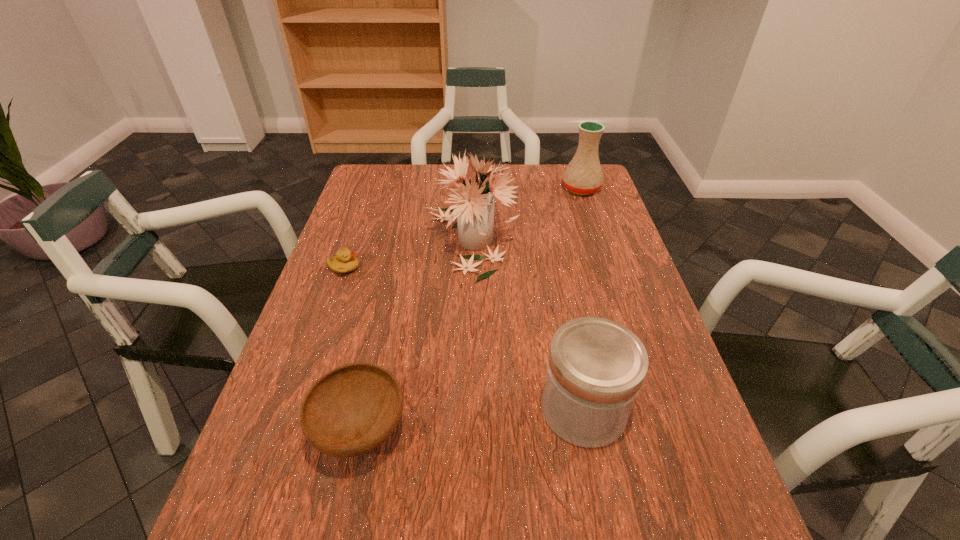
Where is `free spot between the bowl and the tallest object`? Image resolution: width=960 pixels, height=540 pixels. free spot between the bowl and the tallest object is located at coordinates (416, 335).

Locate an element on the screen. Image resolution: width=960 pixels, height=540 pixels. empty space that is in between the bowl and the jar is located at coordinates (472, 420).

Identify the location of object that stands as the closest to the tallest object. (345, 261).

You are a GUI agent. You are given a task and a screenshot of the screen. Output one action in this format:
    pyautogui.click(x=<x>, y=<y>)
    Task: Click on the object that is the second closest to the third tallest object
    This screenshot has width=960, height=540.
    Given the screenshot: What is the action you would take?
    pyautogui.click(x=473, y=207)

Identify the location of vacant region that satisfies the following two spatial constraints: 1. at the beak of the leftmost object; 2. on the left side of the bowl. tap(288, 430).

Where is `vacant area in the image that satisfies the following two spatial constraints: 1. on the back side of the bowl; 2. on the right side of the farthest object`? vacant area in the image that satisfies the following two spatial constraints: 1. on the back side of the bowl; 2. on the right side of the farthest object is located at coordinates (413, 188).

Where is `vacant point that satisfies the following two spatial constraints: 1. on the back side of the bowl; 2. on the left side of the third shortest object`? The width and height of the screenshot is (960, 540). vacant point that satisfies the following two spatial constraints: 1. on the back side of the bowl; 2. on the left side of the third shortest object is located at coordinates (366, 409).

You are a GUI agent. You are given a task and a screenshot of the screen. Output one action in this format:
    pyautogui.click(x=<x>, y=<y>)
    Task: Click on the vacant area that satisfies the following two spatial constraints: 1. on the back side of the second shortest object; 2. at the beak of the leftmost object
    
    Given the screenshot: What is the action you would take?
    pyautogui.click(x=396, y=268)

You are a GUI agent. You are given a task and a screenshot of the screen. Output one action in this format:
    pyautogui.click(x=<x>, y=<y>)
    Task: Click on the vacant point that satisfies the following two spatial constraints: 1. on the front side of the third shortest object; 2. on the left side of the bouquet
    The image size is (960, 540).
    Given the screenshot: What is the action you would take?
    pyautogui.click(x=468, y=409)

This screenshot has width=960, height=540. I want to click on vacant region that satisfies the following two spatial constraints: 1. at the beak of the third shortest object; 2. on the right side of the duckling, so point(296,409).